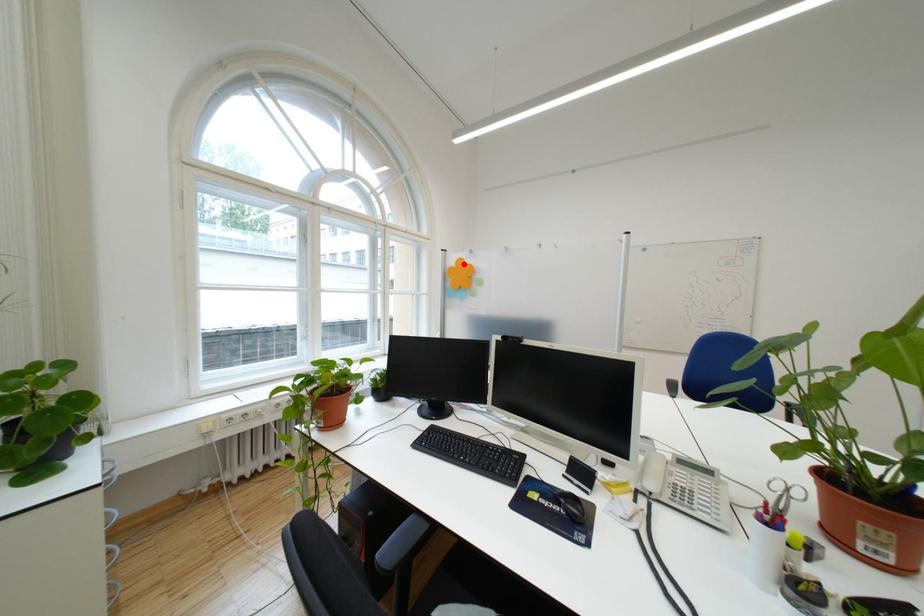
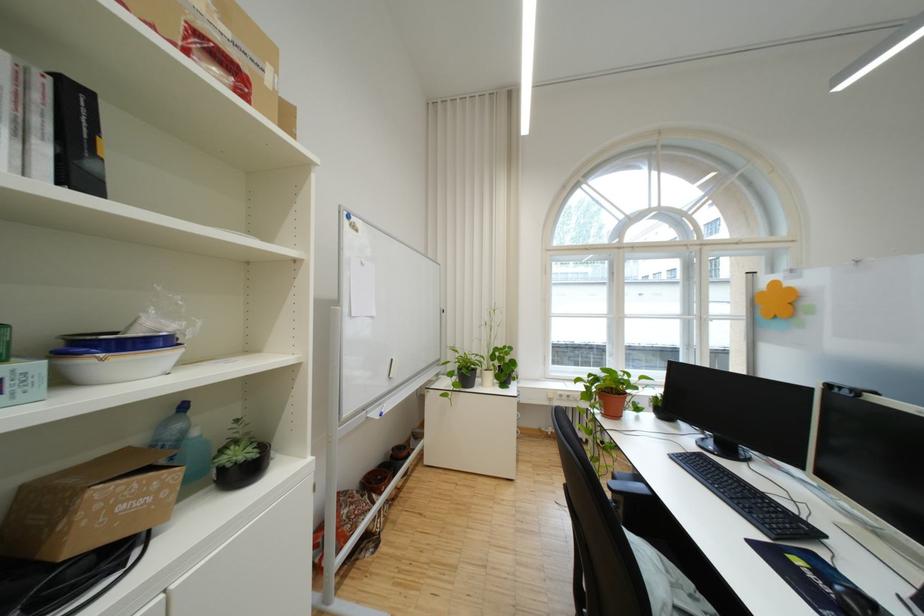
The point at the highlighted location is marked in the first image. Where is the corresponding point in the second image?

(774, 288)